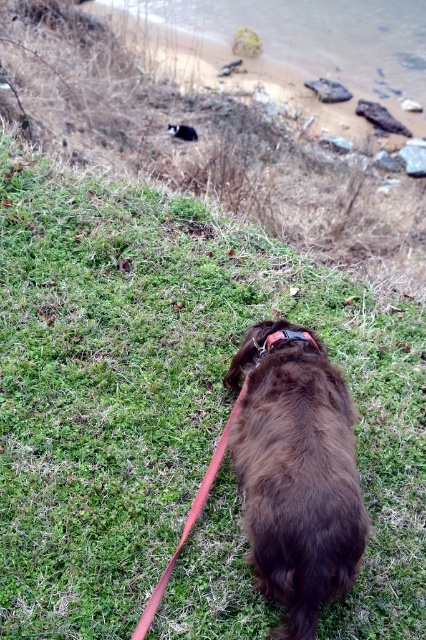
Question: Which of the following is the closest to the observer?

Choices:
 (A) (299, 435)
 (B) (244, 394)
 (C) (281, 84)
 (D) (264, 339)

Answer: (A)

Question: Can you confirm if brown furry dog at center is positioned below red rubber leash at lower center?

Choices:
 (A) no
 (B) yes

Answer: (A)

Question: Is brown sand at upper center to the left of red rubber leash at lower center from the viewer's perspective?

Choices:
 (A) yes
 (B) no

Answer: (B)

Question: Which point is closer to the camera?

Choices:
 (A) rubber/soft neckband at center
 (B) red rubber leash at lower center
 (C) brown sand at upper center

Answer: (B)

Question: Which object appears closest to the camera in this image?

Choices:
 (A) brown furry dog at center
 (B) rubber/soft neckband at center
 (C) red rubber leash at lower center

Answer: (C)

Question: Is red rubber leash at lower center to the right of rubber/soft neckband at center from the viewer's perspective?

Choices:
 (A) no
 (B) yes

Answer: (A)